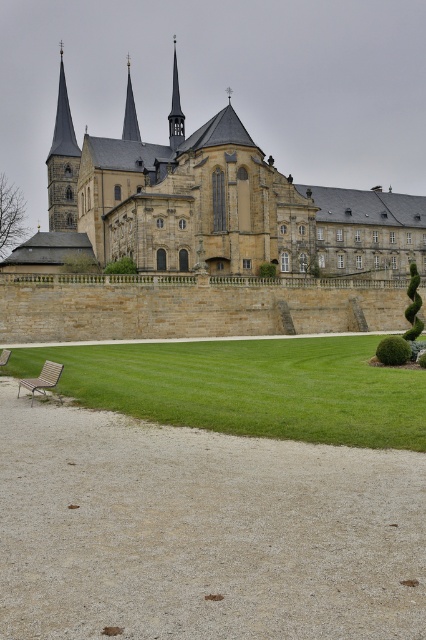
Is polished dark gray spire at center taller than smooth gold spire at upper left?

Indeed, polished dark gray spire at center has a greater height compared to smooth gold spire at upper left.

Is polished dark gray spire at center to the right of smooth gold spire at upper left from the viewer's perspective?

Yes, polished dark gray spire at center is to the right of smooth gold spire at upper left.

Who is more forward, [176,125] or [131,124]?

Point [176,125] is more forward.

Find the location of `polished dark gray spire at center`. polished dark gray spire at center is located at coordinates (175, 109).

Is the position of wooden slats bench at lower left more distant than that of smooth gold spire at upper left?

No, it is in front of smooth gold spire at upper left.

Who is more forward, (48,378) or (137,124)?

Point (48,378) is in front.

In order to click on wooden slats bench at lower left in this screenshot , I will do `click(43, 378)`.

Does polished dark gray spire at center have a lesser width compared to wooden park bench at lower left?

No, polished dark gray spire at center is not thinner than wooden park bench at lower left.

Which is above, polished dark gray spire at center or wooden park bench at lower left?

polished dark gray spire at center is higher up.

Where is `polished dark gray spire at center`? This screenshot has width=426, height=640. polished dark gray spire at center is located at coordinates (175, 109).

Locate an element on the screen. polished dark gray spire at center is located at coordinates [x=175, y=109].